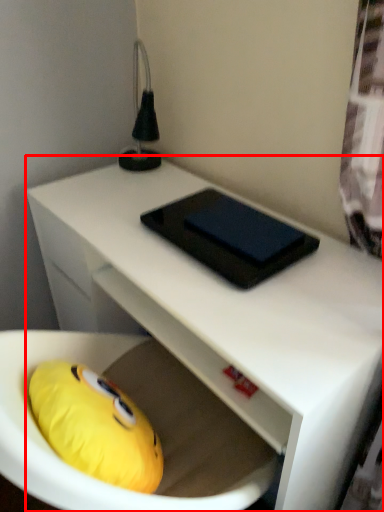
Question: From the image's perspective, where is desk (annotated by the red box) located relative to pad?

Choices:
 (A) below
 (B) above

Answer: (A)